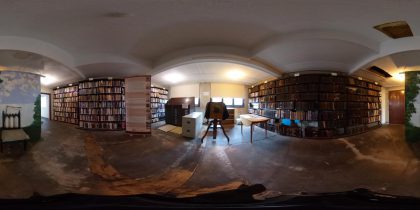
The width and height of the screenshot is (420, 210). In order to click on empty shelves in this screenshot , I will do `click(230, 122)`.